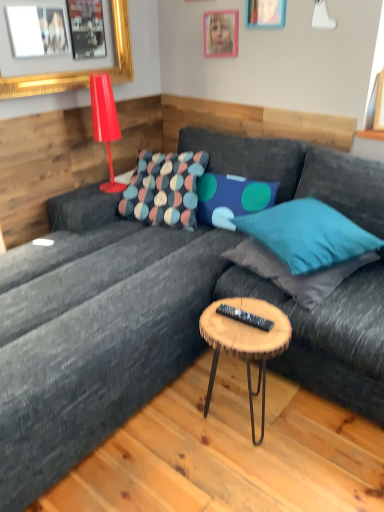
Question: In which direction should I rotate to look at woodenmaterial/texturecoffee table at center?

Choices:
 (A) left
 (B) right

Answer: (B)

Question: Is shiny red lamp at upper left to the left of teal fabric pillow at upper right, the third pillow positioned from the left, from the viewer's perspective?

Choices:
 (A) yes
 (B) no

Answer: (A)

Question: From the image's perspective, does shiny red lamp at upper left appear higher than teal fabric pillow at upper right, the third pillow positioned from the left?

Choices:
 (A) yes
 (B) no

Answer: (A)

Question: Does shiny red lamp at upper left lie in front of teal fabric pillow at upper right, the 2th pillow in the right-to-left sequence?

Choices:
 (A) yes
 (B) no

Answer: (B)

Question: Does shiny red lamp at upper left have a greater height compared to teal fabric pillow at upper right, the third pillow positioned from the left?

Choices:
 (A) yes
 (B) no

Answer: (A)

Question: Is shiny red lamp at upper left wider than teal fabric pillow at upper right, the third pillow positioned from the left?

Choices:
 (A) no
 (B) yes

Answer: (A)

Question: Is shiny red lamp at upper left positioned behind teal fabric pillow at upper right, the third pillow positioned from the left?

Choices:
 (A) yes
 (B) no

Answer: (A)

Question: Is wooden picture frame at upper center, which is the third picture frame from left to right, shorter than black plastic remote at center?

Choices:
 (A) no
 (B) yes

Answer: (A)

Question: Is wooden picture frame at upper center, which is the third picture frame from left to right, further to camera compared to black plastic remote at center?

Choices:
 (A) yes
 (B) no

Answer: (A)

Question: Is wooden picture frame at upper center, which is the third picture frame from left to right, at the right side of black plastic remote at center?

Choices:
 (A) no
 (B) yes

Answer: (B)

Question: From the image's perspective, would you say wooden picture frame at upper center, which is the third picture frame from left to right, is positioned over black plastic remote at center?

Choices:
 (A) no
 (B) yes

Answer: (B)

Question: Is there a large distance between wooden picture frame at upper center, which is the third picture frame from left to right, and black plastic remote at center?

Choices:
 (A) no
 (B) yes

Answer: (B)

Question: From a real-world perspective, is wooden picture frame at upper center, which is the third picture frame from left to right, beneath black plastic remote at center?

Choices:
 (A) yes
 (B) no

Answer: (B)

Question: Is teal fabric pillow at upper right, the 2th pillow in the right-to-left sequence, to the right of shiny red lamp at upper left from the viewer's perspective?

Choices:
 (A) no
 (B) yes

Answer: (B)